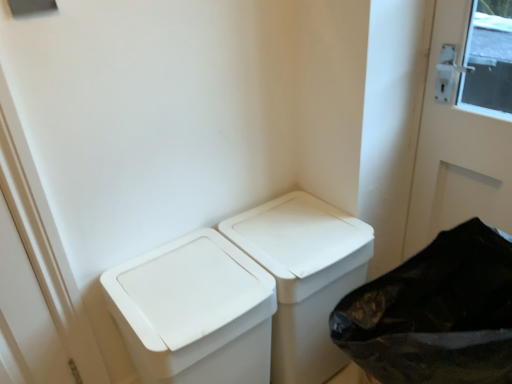
You are a GUI agent. You are given a task and a screenshot of the screen. Output one action in this format:
    pyautogui.click(x=<x>, y=<y>)
    Task: Click on the vacant point above white plastic waste container at center, which is the 2th waste container from left to right (from a real-world perspective)
    The height and width of the screenshot is (384, 512).
    Given the screenshot: What is the action you would take?
    pyautogui.click(x=293, y=231)